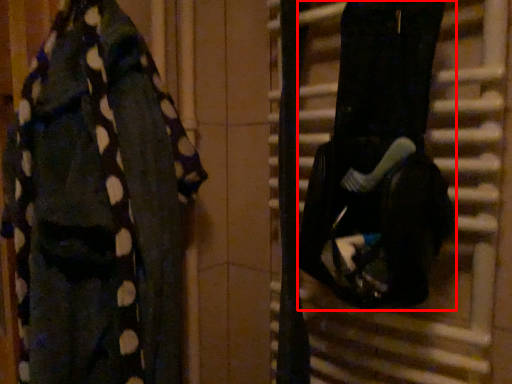
Question: From the image, what is the correct spatial relationship of wide (annotated by the red box) in relation to underclothes?

Choices:
 (A) left
 (B) right

Answer: (B)